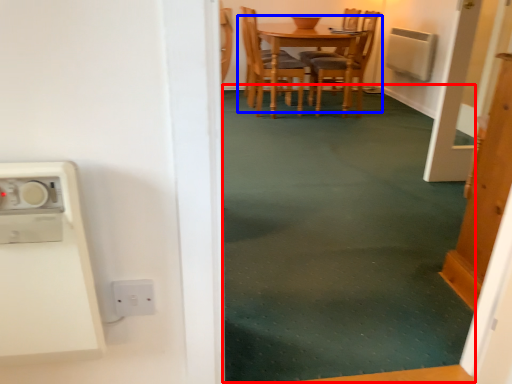
Question: Which object is closer to the camera taking this photo, plain (highlighted by a red box) or kitchen & dining room table (highlighted by a blue box)?

Choices:
 (A) plain
 (B) kitchen & dining room table

Answer: (A)